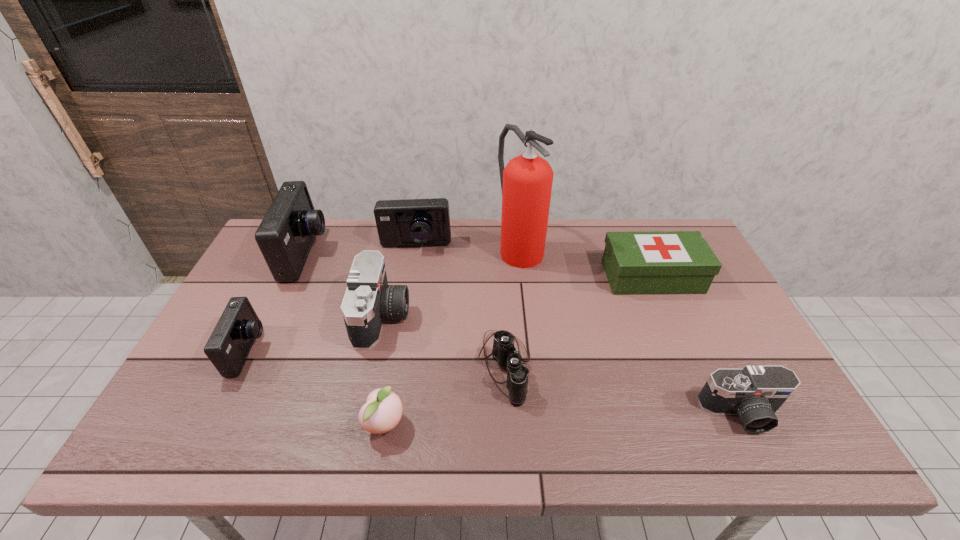
Where is `vacant space at the far edge of the desktop`? The width and height of the screenshot is (960, 540). vacant space at the far edge of the desktop is located at coordinates (386, 257).

Identify the location of vacant area at the near edge of the desktop. (428, 446).

Where is `free space at the left edge of the desktop`? The width and height of the screenshot is (960, 540). free space at the left edge of the desktop is located at coordinates (200, 394).

The width and height of the screenshot is (960, 540). What are the coordinates of `vacant space at the right edge` in the screenshot? It's located at (717, 325).

Image resolution: width=960 pixels, height=540 pixels. In order to click on free spot at the near left corner of the desktop in this screenshot , I will do (187, 430).

You are a GUI agent. You are given a task and a screenshot of the screen. Output one action in this format:
    pyautogui.click(x=<x>, y=<y>)
    Task: Click on the free space at the near right corner of the desktop
    
    Given the screenshot: What is the action you would take?
    pyautogui.click(x=804, y=434)

Locate an element on the screen. empty space between the nearest blue camera and the binoculars is located at coordinates (376, 359).

The image size is (960, 540). What are the coordinates of `empty location between the tallest object and the first-aid kit` in the screenshot? It's located at (586, 262).

At what (x,y) coordinates should I click in order to perform the action: click on free point between the first-aid kit and the rightmost camera. Please return your answer as a coordinate pair (x, y). Looking at the image, I should click on (697, 345).

Find the location of a particular element. Image resolution: width=960 pixels, height=540 pixels. empty space between the biggest blue camera and the bigger black camera is located at coordinates (345, 286).